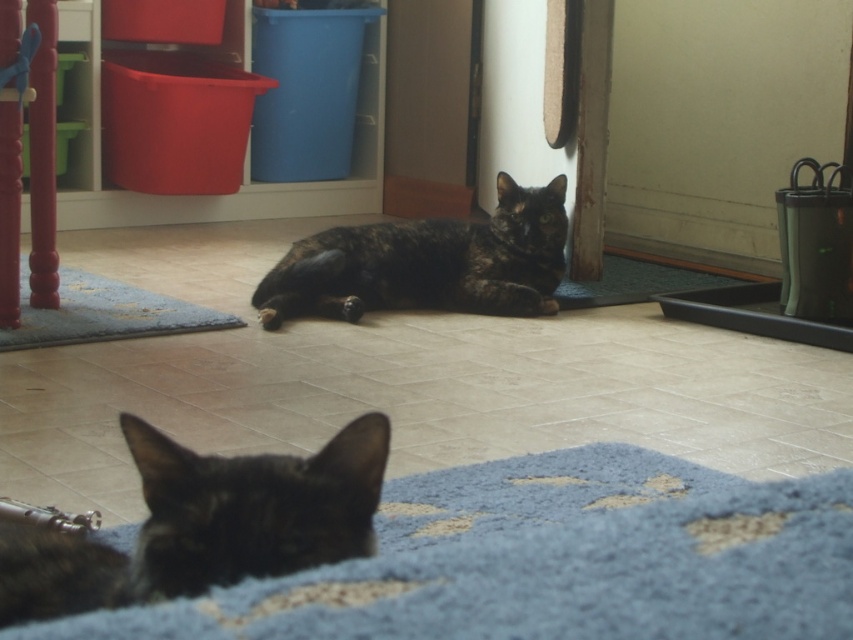
Is blue shaggy mat at lower center thinner than tortoiseshell fur cat at center?

Yes, blue shaggy mat at lower center is thinner than tortoiseshell fur cat at center.

Is point (635, 502) less distant than point (358, 314)?

Yes, point (635, 502) is in front of point (358, 314).

Between point (769, 595) and point (341, 250), which one is positioned behind?

The point (341, 250) is behind.

The width and height of the screenshot is (853, 640). In order to click on blue shaggy mat at lower center in this screenshot , I will do `click(550, 561)`.

Can you confirm if blue shaggy mat at lower center is positioned below blue shaggy mat at lower left?

Yes, blue shaggy mat at lower center is below blue shaggy mat at lower left.

Is point (512, 576) behind point (96, 323)?

No, it is in front of (96, 323).

Which is in front, point (428, 513) or point (189, 317)?

Point (428, 513) is in front.

I want to click on blue shaggy mat at lower center, so click(x=550, y=561).

Does blue shaggy mat at lower center have a greater height compared to shiny black cat at lower left?

No.

Is point (491, 484) positioned before point (346, 525)?

That is False.

Identify the location of blue shaggy mat at lower center. The image size is (853, 640). (550, 561).